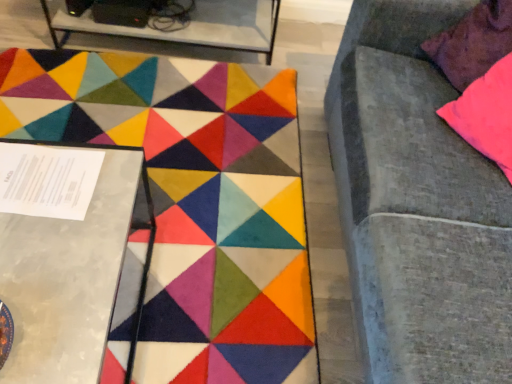
The image size is (512, 384). What do you see at coordinates (473, 43) in the screenshot?
I see `pink fabric pillow at upper right` at bounding box center [473, 43].

This screenshot has width=512, height=384. Identify the location of carpet with geometric patterns at center. (x=193, y=201).

Considering the sizes of velvet gray couch at right and metallic glass table at upper left, acting as the first table starting from the top, in the image, is velvet gray couch at right taller or shorter than metallic glass table at upper left, acting as the first table starting from the top,?

Considering their sizes, velvet gray couch at right has more height than metallic glass table at upper left, acting as the first table starting from the top.

From a real-world perspective, which object rests below the other?

metallic glass table at upper left, arranged as the 2th table when viewed from the front.

Would you say velvet gray couch at right is outside metallic glass table at upper left, marked as the 1th table in a back-to-front arrangement?

Absolutely, velvet gray couch at right is external to metallic glass table at upper left, marked as the 1th table in a back-to-front arrangement.

Measure the distance from velvet gray couch at right to metallic glass table at upper left, arranged as the 2th table when viewed from the front.

3.34 feet.

From a real-world perspective, starting from the velvet gray couch at right, which table is the 1st one below it? Please provide its 2D coordinates.

[(66, 255)]

Based on the photo, from a real-world perspective, between velvet gray couch at right and metallic silver table at left, positioned as the second table in top-to-bottom order, who is vertically higher?

velvet gray couch at right is physically above.

Is velvet gray couch at right oriented away from metallic silver table at left, placed as the first table when sorted from front to back?

velvet gray couch at right is not turned away from metallic silver table at left, placed as the first table when sorted from front to back.

Considering the relative sizes of velvet gray couch at right and metallic silver table at left, positioned as the 1th table in bottom-to-top order, in the image provided, is velvet gray couch at right thinner than metallic silver table at left, positioned as the 1th table in bottom-to-top order,?

No.

Based on the photo, who is bigger, metallic silver table at left, positioned as the second table in top-to-bottom order, or velvet gray couch at right?

velvet gray couch at right.

From a real-world perspective, which is physically above, metallic silver table at left, positioned as the second table in top-to-bottom order, or velvet gray couch at right?

velvet gray couch at right.

Considering the positions of points (93, 289) and (503, 302), is point (93, 289) closer to camera compared to point (503, 302)?

Yes.

Which of these two, pink fabric pillow at upper right or velvet gray couch at right, is smaller?

pink fabric pillow at upper right is smaller.

Does point (479, 75) come behind point (432, 256)?

Yes, it is behind point (432, 256).

Would you say pink fabric pillow at upper right contains velvet gray couch at right?

No, pink fabric pillow at upper right does not contain velvet gray couch at right.

Consider the image. Between pink fabric pillow at upper right and carpet with geometric patterns at center, which one has larger width?

With larger width is carpet with geometric patterns at center.

Which is behind, point (461, 64) or point (166, 98)?

Point (166, 98)

Which of these two, pink fabric pillow at upper right or carpet with geometric patterns at center, is smaller?

pink fabric pillow at upper right is smaller.

Is pink fabric pillow at upper right oriented towards carpet with geometric patterns at center?

No, pink fabric pillow at upper right is not facing towards carpet with geometric patterns at center.

Could pink fabric pillow at upper right be considered to be inside carpet with geometric patterns at center?

No, pink fabric pillow at upper right is not a part of carpet with geometric patterns at center.

Between carpet with geometric patterns at center and pink fabric pillow at upper right, which one has larger size?

Bigger between the two is carpet with geometric patterns at center.

Locate an element on the screen. pillow that appears above the carpet with geometric patterns at center (from the image's perspective) is located at coordinates (473, 43).

Is carpet with geometric patterns at center oriented towards pink fabric pillow at upper right?

No.

Considering their positions, is metallic glass table at upper left, marked as the 1th table in a back-to-front arrangement, located in front of or behind velvet gray couch at right?

metallic glass table at upper left, marked as the 1th table in a back-to-front arrangement, is positioned farther from the viewer than velvet gray couch at right.

Which is more to the right, metallic glass table at upper left, placed as the 2th table when sorted from bottom to top, or velvet gray couch at right?

From the viewer's perspective, velvet gray couch at right appears more on the right side.

I want to click on table above the velvet gray couch at right (from the image's perspective), so click(187, 26).

Looking at the image, does metallic glass table at upper left, marked as the 1th table in a back-to-front arrangement, seem bigger or smaller compared to velvet gray couch at right?

Clearly, metallic glass table at upper left, marked as the 1th table in a back-to-front arrangement, is smaller in size than velvet gray couch at right.

Where is `table that is above the velvet gray couch at right (from the image's perspective)`? Image resolution: width=512 pixels, height=384 pixels. table that is above the velvet gray couch at right (from the image's perspective) is located at coordinates (187, 26).

Locate an element on the screen. furniture that appears in front of the metallic silver table at left, positioned as the second table in top-to-bottom order is located at coordinates (418, 205).

Based on their spatial positions, is metallic silver table at left, which is the 2th table in back-to-front order, or velvet gray couch at right closer to metallic glass table at upper left, marked as the 1th table in a back-to-front arrangement?

Based on the image, velvet gray couch at right appears to be nearer to metallic glass table at upper left, marked as the 1th table in a back-to-front arrangement.

Estimate the real-world distances between objects in this image. Which object is closer to carpet with geometric patterns at center, velvet gray couch at right or metallic silver table at left, positioned as the 1th table in bottom-to-top order?

metallic silver table at left, positioned as the 1th table in bottom-to-top order, is closer to carpet with geometric patterns at center.

When comparing their distances from metallic glass table at upper left, placed as the 2th table when sorted from bottom to top, does velvet gray couch at right or carpet with geometric patterns at center seem closer?

Among the two, carpet with geometric patterns at center is located nearer to metallic glass table at upper left, placed as the 2th table when sorted from bottom to top.

Based on their spatial positions, is pink fabric pillow at upper right or carpet with geometric patterns at center closer to velvet gray couch at right?

Based on the image, pink fabric pillow at upper right appears to be nearer to velvet gray couch at right.

From the image, which object appears to be nearer to metallic silver table at left, positioned as the 1th table in bottom-to-top order, carpet with geometric patterns at center or metallic glass table at upper left, arranged as the 2th table when viewed from the front?

carpet with geometric patterns at center is closer to metallic silver table at left, positioned as the 1th table in bottom-to-top order.

From the image, which object appears to be nearer to carpet with geometric patterns at center, pink fabric pillow at upper right or metallic silver table at left, positioned as the 1th table in bottom-to-top order?

metallic silver table at left, positioned as the 1th table in bottom-to-top order, is positioned closer to the anchor carpet with geometric patterns at center.

Estimate the real-world distances between objects in this image. Which object is closer to pink fabric pillow at upper right, metallic silver table at left, which is the 2th table in back-to-front order, or velvet gray couch at right?

Based on the image, velvet gray couch at right appears to be nearer to pink fabric pillow at upper right.

Considering their positions, is metallic glass table at upper left, placed as the 2th table when sorted from bottom to top, positioned further to metallic silver table at left, positioned as the 1th table in bottom-to-top order, than carpet with geometric patterns at center?

Based on the image, metallic glass table at upper left, placed as the 2th table when sorted from bottom to top, appears to be further to metallic silver table at left, positioned as the 1th table in bottom-to-top order.

You are a GUI agent. You are given a task and a screenshot of the screen. Output one action in this format:
    pyautogui.click(x=<x>, y=<y>)
    Task: Click on the pillow between metallic silver table at left, positioned as the second table in top-to-bottom order, and velvet gray couch at right
    The image size is (512, 384).
    Given the screenshot: What is the action you would take?
    pyautogui.click(x=473, y=43)

At what (x,y) coordinates should I click in order to perform the action: click on table between metallic silver table at left, placed as the first table when sorted from front to back, and velvet gray couch at right. Please return your answer as a coordinate pair (x, y). Looking at the image, I should click on (187, 26).

I want to click on mat located between metallic silver table at left, which is the 2th table in back-to-front order, and velvet gray couch at right in the left-right direction, so click(193, 201).

Where is `mat situated between metallic silver table at left, positioned as the 1th table in bottom-to-top order, and pink fabric pillow at upper right from left to right`? The image size is (512, 384). mat situated between metallic silver table at left, positioned as the 1th table in bottom-to-top order, and pink fabric pillow at upper right from left to right is located at coordinates (193, 201).